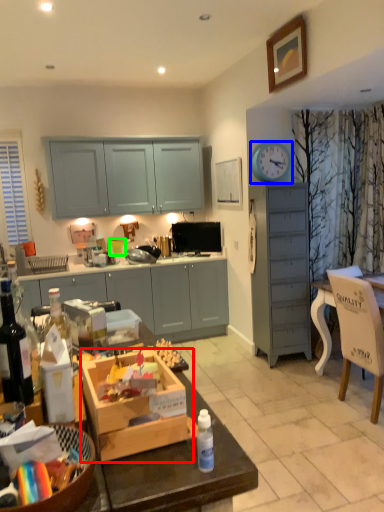
Question: Estimate the real-world distances between objects in this image. Which object is farther from cardboard box (highlighted by a red box), clock (highlighted by a blue box) or coffee cup (highlighted by a green box)?

Choices:
 (A) clock
 (B) coffee cup

Answer: (B)